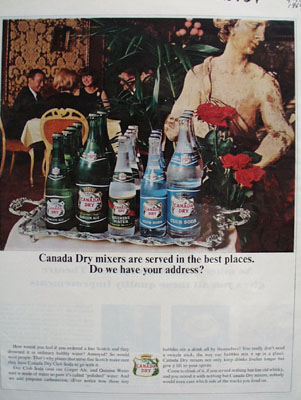
This screenshot has height=400, width=301. In order to click on chair in this screenshot , I will do `click(65, 120)`.